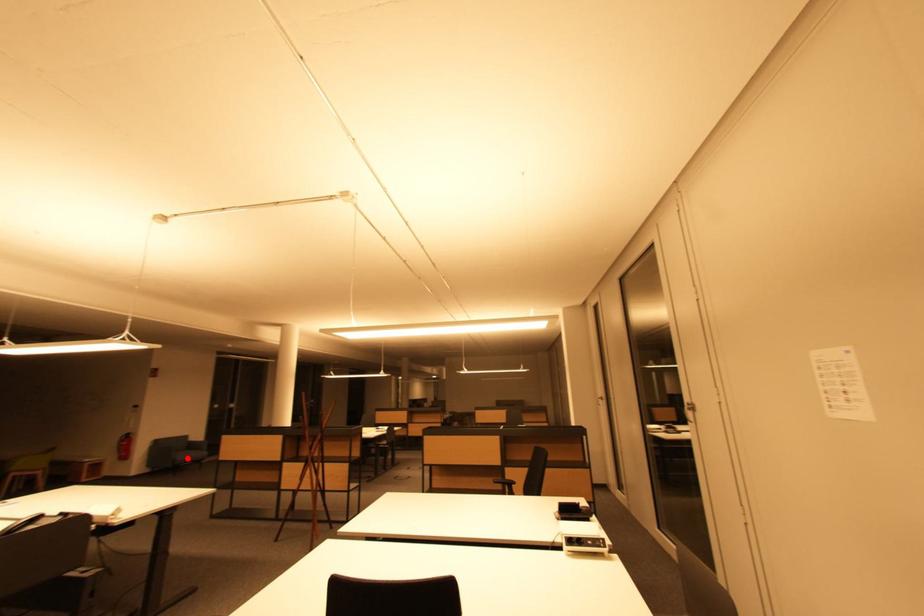
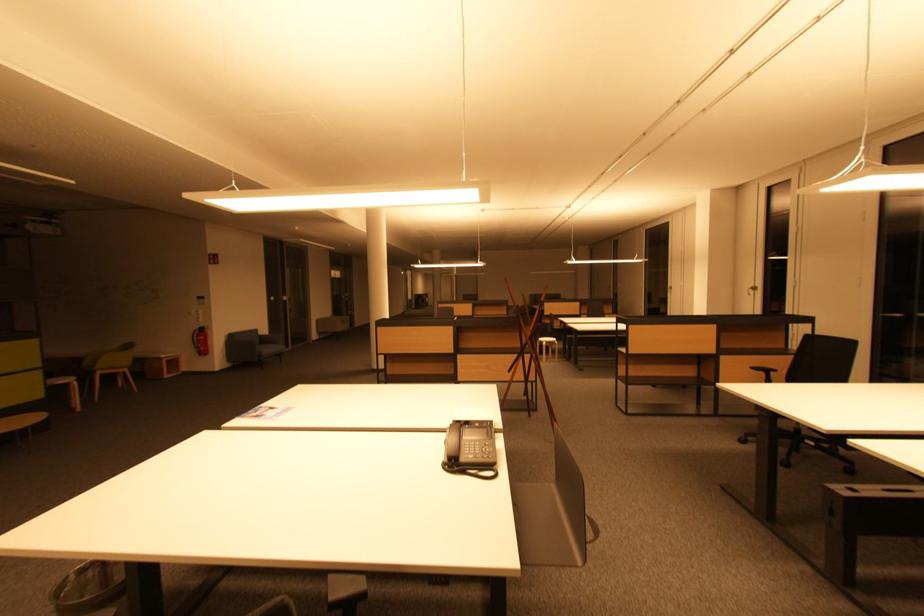
Locate, in the second image, the point that corresponds to the highlighted location in the first image.

(272, 352)